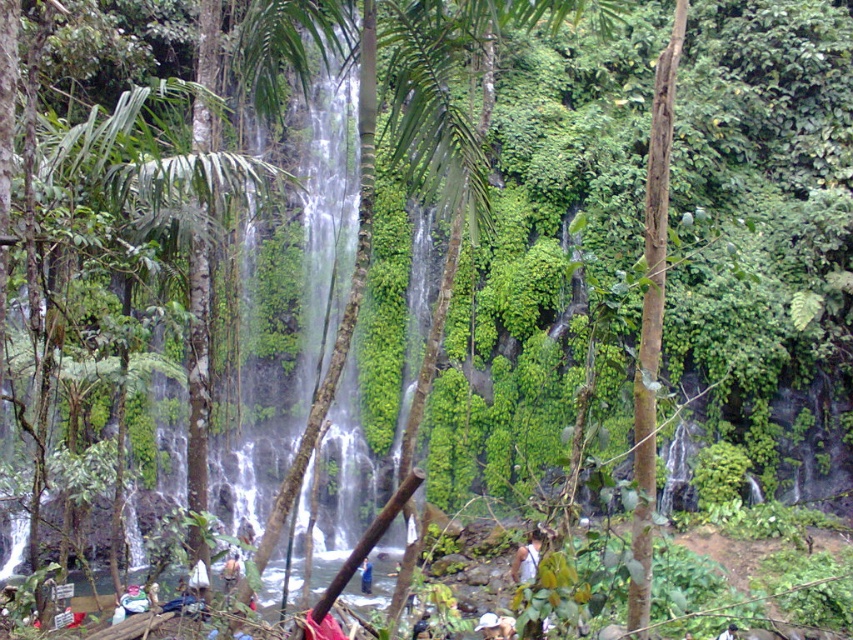
Question: Which object appears closest to the camera in this image?

Choices:
 (A) white fabric at center
 (B) blue fabric at center

Answer: (A)

Question: Is white fabric at center smaller than dark blue fabric at lower right?

Choices:
 (A) no
 (B) yes

Answer: (A)

Question: Among these points, which one is farthest from the camera?

Choices:
 (A) (527, 557)
 (B) (363, 563)

Answer: (B)

Question: Can you confirm if white fabric at center is wider than blue fabric at center?

Choices:
 (A) no
 (B) yes

Answer: (B)

Question: Which point is farther to the camera?

Choices:
 (A) (722, 634)
 (B) (363, 561)
 (C) (512, 572)

Answer: (C)

Question: Can you confirm if white fabric at center is positioned above dark blue fabric at lower right?

Choices:
 (A) yes
 (B) no

Answer: (A)